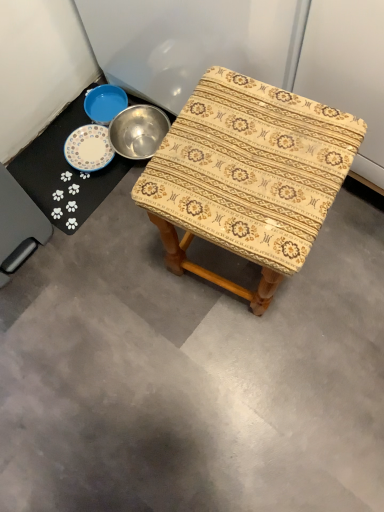
Identify the location of free space in front of white glossy plate at upper left. (98, 263).